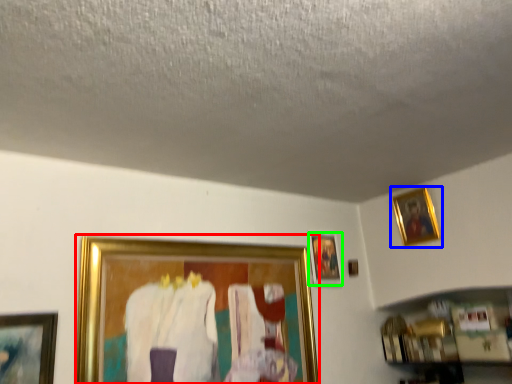
Question: Based on their relative distances, which object is nearer to picture frame (highlighted by a red box)? Choose from picture frame (highlighted by a blue box) and picture frame (highlighted by a green box).

Choices:
 (A) picture frame
 (B) picture frame

Answer: (B)